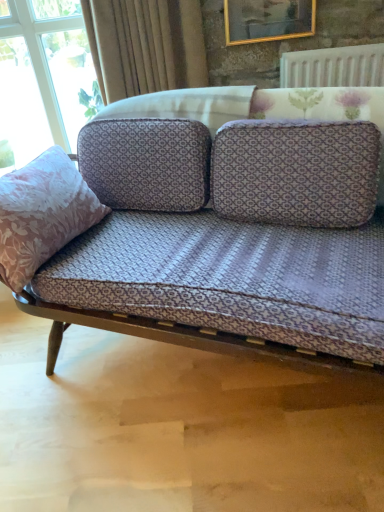
Question: Is white textured radiator at upper right to the left or to the right of velvet beige curtain at upper center in the image?

Choices:
 (A) right
 (B) left

Answer: (A)

Question: Considering their positions, is white textured radiator at upper right located in front of or behind velvet beige curtain at upper center?

Choices:
 (A) front
 (B) behind

Answer: (B)

Question: Considering the real-world distances, which object is farthest from the lavender fabric couch at center?

Choices:
 (A) white textured radiator at upper right
 (B) pink floral fabric pillow at left
 (C) gold-framed picture at upper center
 (D) velvet beige curtain at upper center

Answer: (C)

Question: Estimate the real-world distances between objects in this image. Which object is farther from the pink floral fabric pillow at left?

Choices:
 (A) lavender fabric couch at center
 (B) white textured radiator at upper right
 (C) gold-framed picture at upper center
 (D) velvet beige curtain at upper center

Answer: (B)